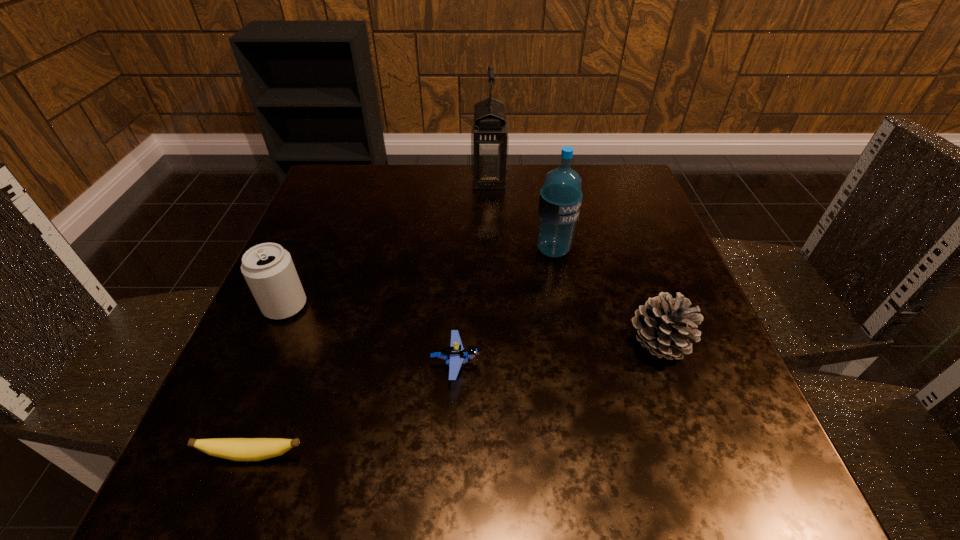
This screenshot has width=960, height=540. I want to click on free spot between the fifth tallest object and the water bottle, so click(x=504, y=307).

The width and height of the screenshot is (960, 540). I want to click on free spot between the second shortest object and the lantern, so click(472, 271).

Find the location of a particular element. The image size is (960, 540). free space between the pinecone and the banana is located at coordinates (455, 399).

Find the location of `blank region between the fourth tallest object and the lantern`. blank region between the fourth tallest object and the lantern is located at coordinates (573, 261).

Find the location of a particular element. Image resolution: width=960 pixels, height=540 pixels. unoccupied position between the fourth tallest object and the banana is located at coordinates (455, 399).

You are a GUI agent. You are given a task and a screenshot of the screen. Output one action in this format:
    pyautogui.click(x=<x>, y=<y>)
    Task: Click on the vacant area that lies between the fourth tallest object and the nearest object
    The image size is (960, 540).
    Given the screenshot: What is the action you would take?
    pyautogui.click(x=455, y=399)

I want to click on vacant region between the Lego and the second object from right to left, so click(504, 307).

Locate an element on the screen. The width and height of the screenshot is (960, 540). free space between the Lego and the banana is located at coordinates (354, 409).

I want to click on free space between the fourth tallest object and the banana, so click(455, 399).

In order to click on vacant area that lies between the rightmost object and the second farthest object in this screenshot , I will do `click(606, 297)`.